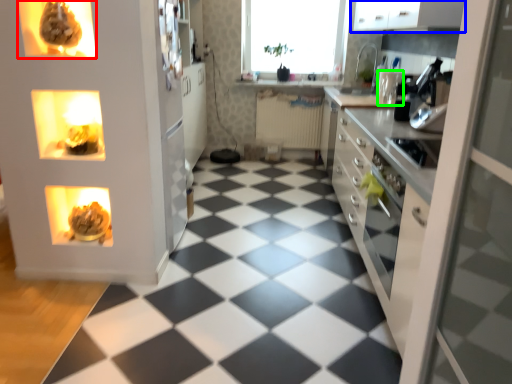
Question: Based on their relative distances, which object is farther from appliance (highlighted by a red box)? Choose from cabinetry (highlighted by a blue box) and appliance (highlighted by a green box).

Choices:
 (A) cabinetry
 (B) appliance

Answer: (B)